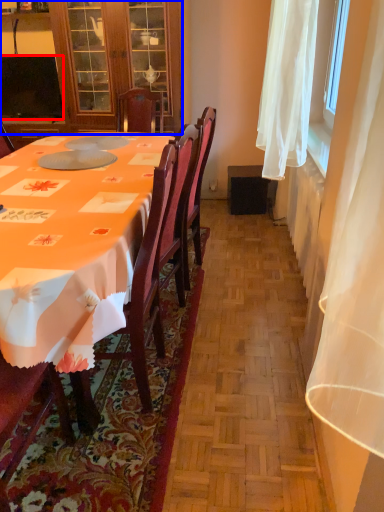
Question: Which point is further to the camera, television (highlighted by a red box) or cabinetry (highlighted by a blue box)?

Choices:
 (A) television
 (B) cabinetry

Answer: (A)